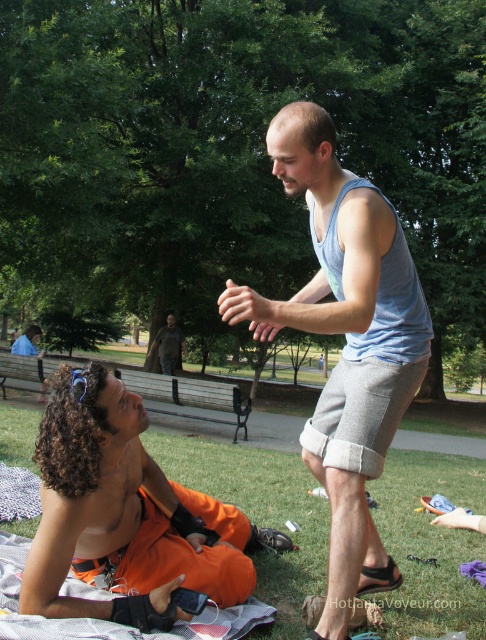
Question: Does orange fabric pants at lower left have a greater width compared to camouflage fabric jacket at center?

Choices:
 (A) yes
 (B) no

Answer: (A)

Question: Which object appears farthest from the camera in this image?

Choices:
 (A) light blue tank top at center
 (B) orange fabric pants at lower left

Answer: (B)

Question: Which object is the farthest from the light blue tank top at center?

Choices:
 (A) camouflage fabric jacket at center
 (B) orange fabric pants at lower left

Answer: (A)

Question: Is light blue tank top at center above orange fabric pants at lower left?

Choices:
 (A) no
 (B) yes

Answer: (B)

Question: Which point is closer to the camera?

Choices:
 (A) orange fabric pants at lower left
 (B) light blue tank top at center
 (C) camouflage fabric jacket at center

Answer: (B)

Question: Can you confirm if orange fabric pants at lower left is positioned to the right of camouflage fabric jacket at center?

Choices:
 (A) yes
 (B) no

Answer: (A)